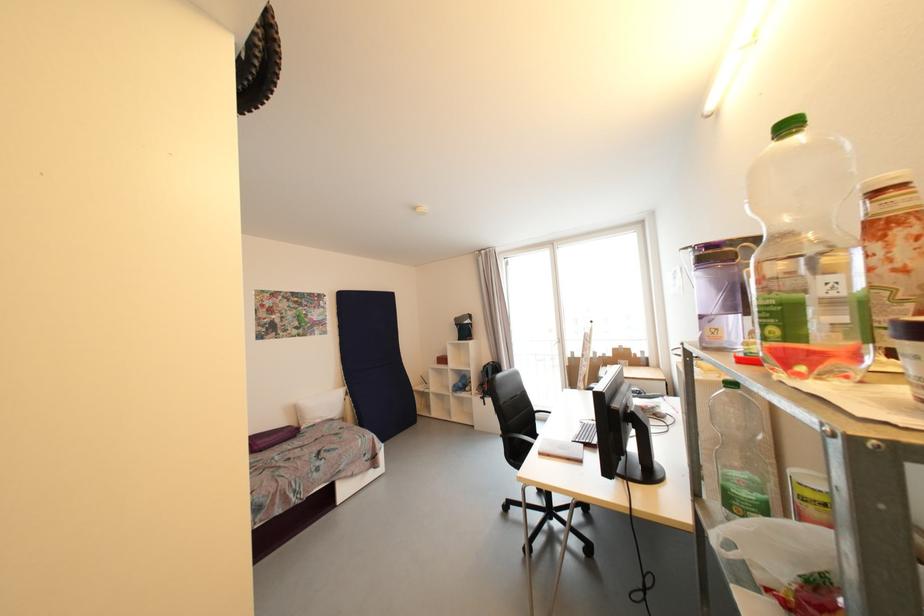
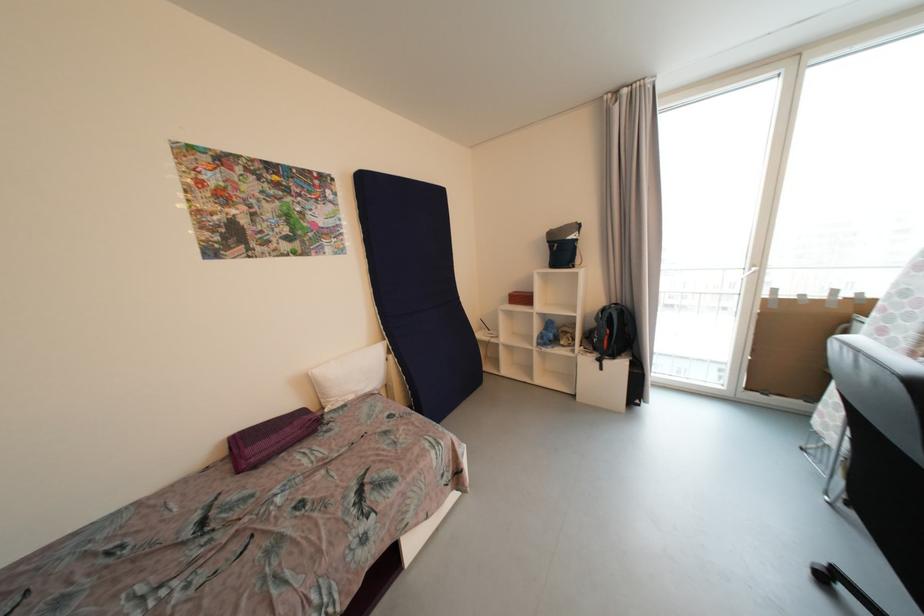
The point at (490, 368) is marked in the first image. Where is the corresponding point in the second image?

(608, 312)